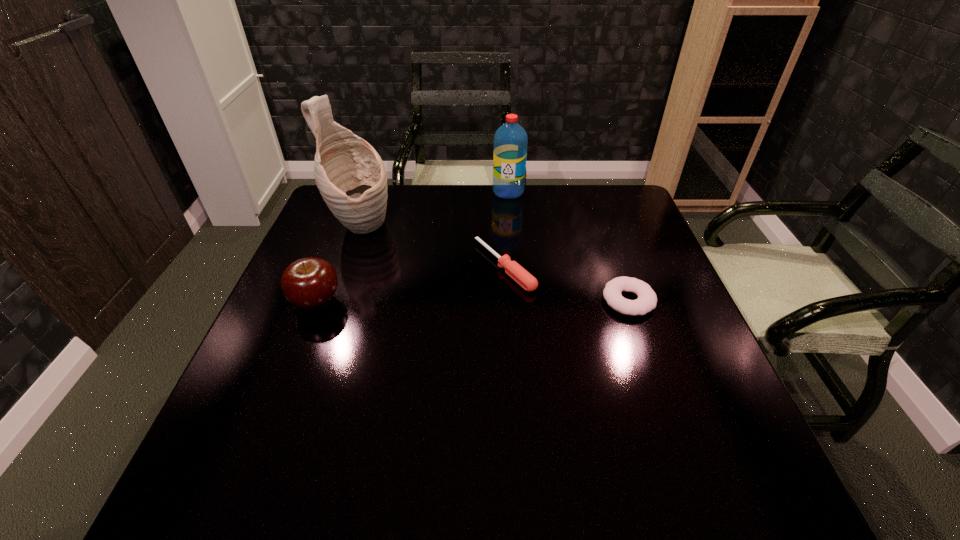
The height and width of the screenshot is (540, 960). What are the coordinates of `apple` in the screenshot? It's located at (310, 283).

Find the location of a particular element. The width and height of the screenshot is (960, 540). doughnut is located at coordinates (647, 299).

I want to click on the second tallest object, so click(x=510, y=140).

Find the location of `the farthest object`. the farthest object is located at coordinates (510, 140).

This screenshot has height=540, width=960. I want to click on screwdriver, so click(528, 282).

Identify the location of pitcher. This screenshot has width=960, height=540. (350, 175).

I want to click on free point located on the front of the apple, so click(291, 366).

Image resolution: width=960 pixels, height=540 pixels. I want to click on vacant space situated 0.290m on the back of the doughnut, so click(x=599, y=218).

This screenshot has width=960, height=540. What are the coordinates of `free space located 0.220m on the front label of the water bottle` in the screenshot? It's located at (481, 239).

Locate an element on the screen. vacant space situated 0.310m on the front label of the water bottle is located at coordinates (470, 258).